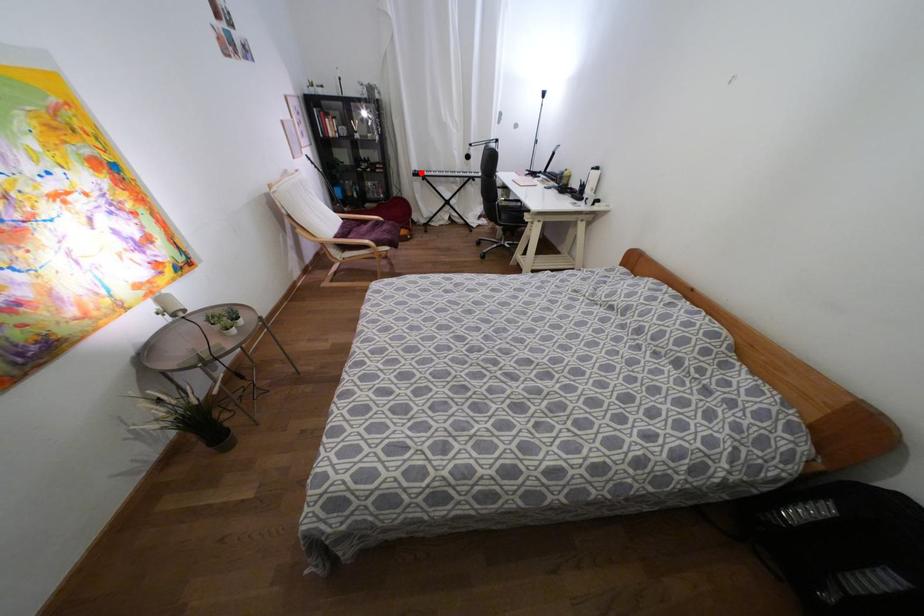
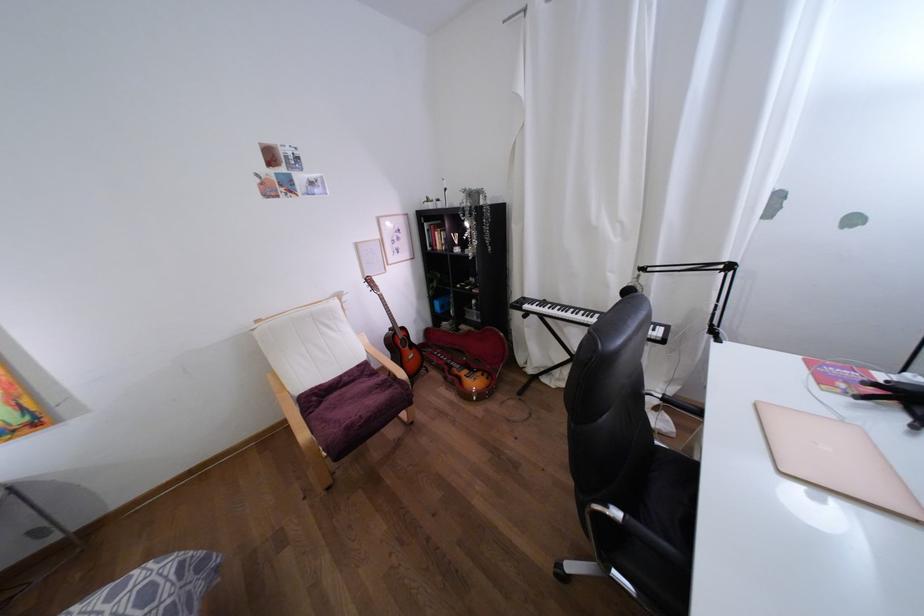
Where in the second image is the point corresponding to the highlighted location from the first image?

(525, 306)